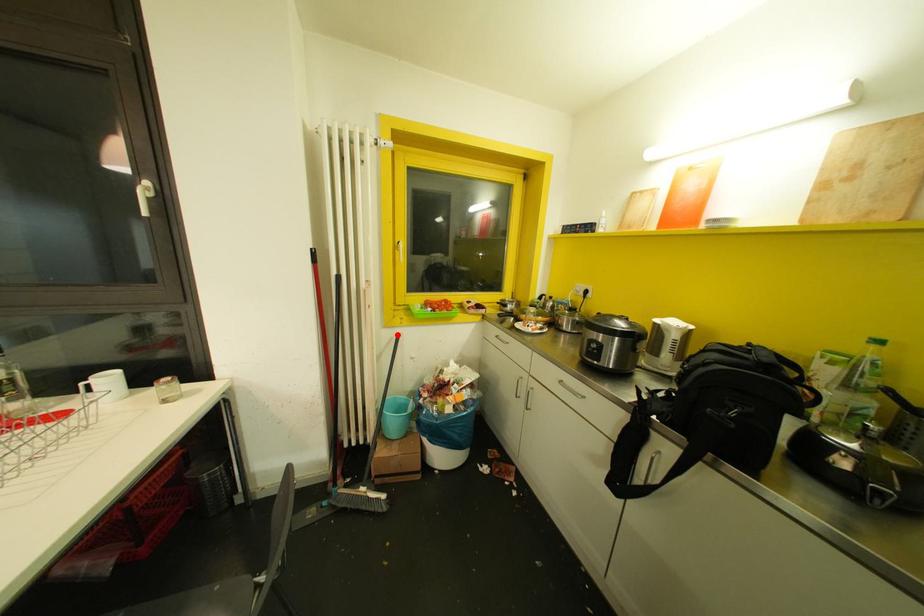
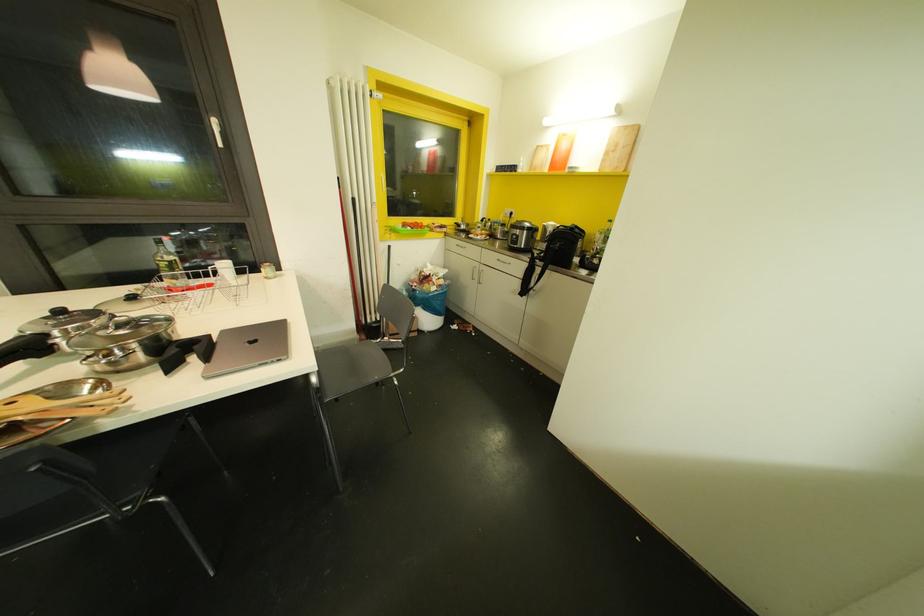
Find the pixel in the second image that matches the highlighted location in the first image.

(388, 246)